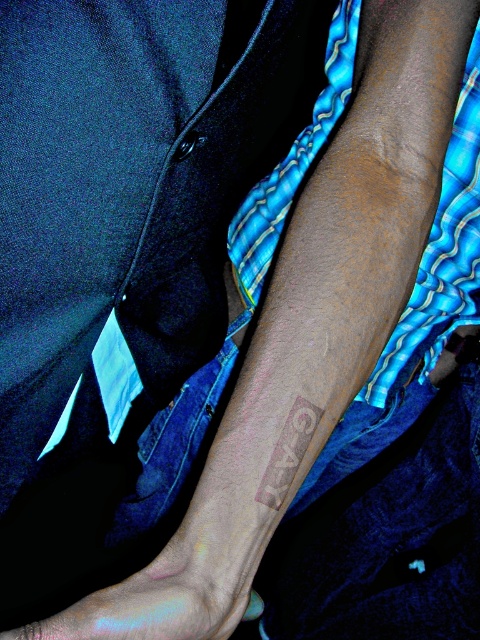
Which of these two, gray matte tattoo at lower center or smooth skin tattoo at lower left, stands shorter?

With less height is smooth skin tattoo at lower left.

Is gray matte tattoo at lower center further to the viewer compared to smooth skin tattoo at lower left?

Yes.

Which is behind, point (301, 408) or point (261, 604)?

The point (261, 604) is more distant.

The image size is (480, 640). Find the location of `gray matte tattoo at lower center`. gray matte tattoo at lower center is located at coordinates (288, 452).